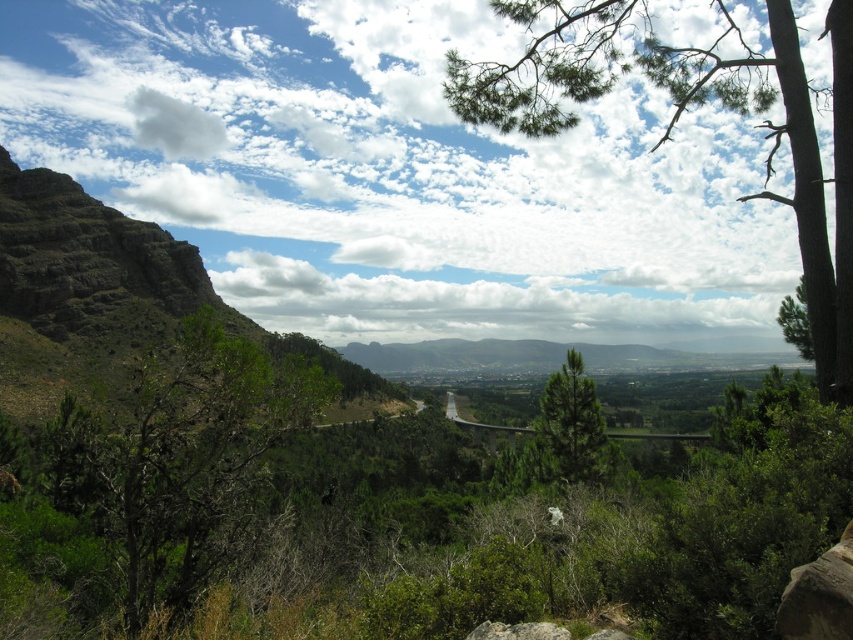
Who is positioned more to the right, green leafy tree at upper right or green textured pine tree at right?

From the viewer's perspective, green textured pine tree at right appears more on the right side.

Who is positioned more to the left, green leafy tree at upper right or green textured pine tree at right?

From the viewer's perspective, green leafy tree at upper right appears more on the left side.

Is point (543, 12) behind point (808, 321)?

No, (543, 12) is closer to viewer.

At what (x,y) coordinates should I click in order to perform the action: click on green leafy tree at upper right. Please return your answer as a coordinate pair (x, y). Looking at the image, I should click on (683, 109).

Does white fluffy cloud at upper center appear under gray rough rock at lower center?

Incorrect, white fluffy cloud at upper center is not positioned below gray rough rock at lower center.

Is the position of white fluffy cloud at upper center less distant than that of gray rough rock at lower center?

Result: No, white fluffy cloud at upper center is behind gray rough rock at lower center.

Between point (161, 100) and point (561, 632), which one is positioned behind?

Point (161, 100)

This screenshot has height=640, width=853. I want to click on white fluffy cloud at upper center, so click(x=173, y=125).

Looking at this image, can you confirm if green leafy tree at upper right is smaller than white fluffy cloud at upper center?

No, green leafy tree at upper right is not smaller than white fluffy cloud at upper center.

How far apart are green leafy tree at upper right and white fluffy cloud at upper center?

green leafy tree at upper right is 416.61 meters from white fluffy cloud at upper center.

Which is in front, point (798, 141) or point (175, 124)?

Positioned in front is point (798, 141).

Find the location of a particular element. This screenshot has height=640, width=853. green leafy tree at upper right is located at coordinates (683, 109).